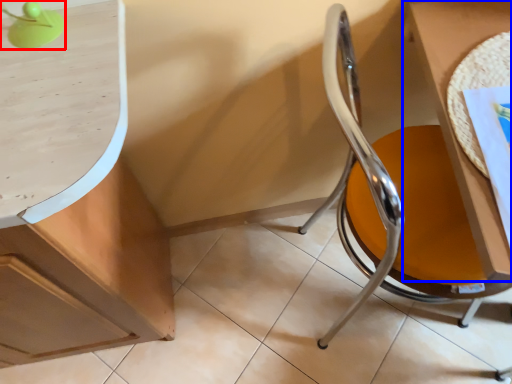
Question: Which of the following is the farthest to the observer, table lamp (highlighted by a red box) or table (highlighted by a blue box)?

Choices:
 (A) table lamp
 (B) table

Answer: (B)